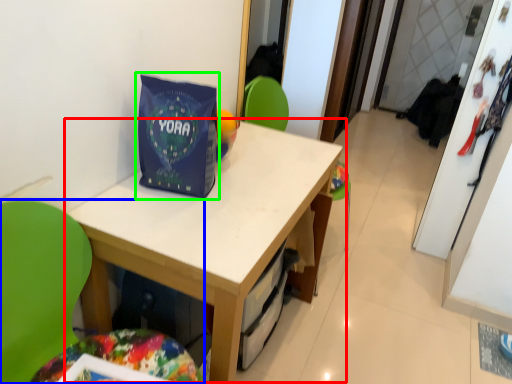
Question: Estimate the real-world distances between objects in this image. Which object is closer to table (highlighted by a red box), chair (highlighted by a blue box) or gift bag (highlighted by a green box)?

Choices:
 (A) chair
 (B) gift bag

Answer: (B)